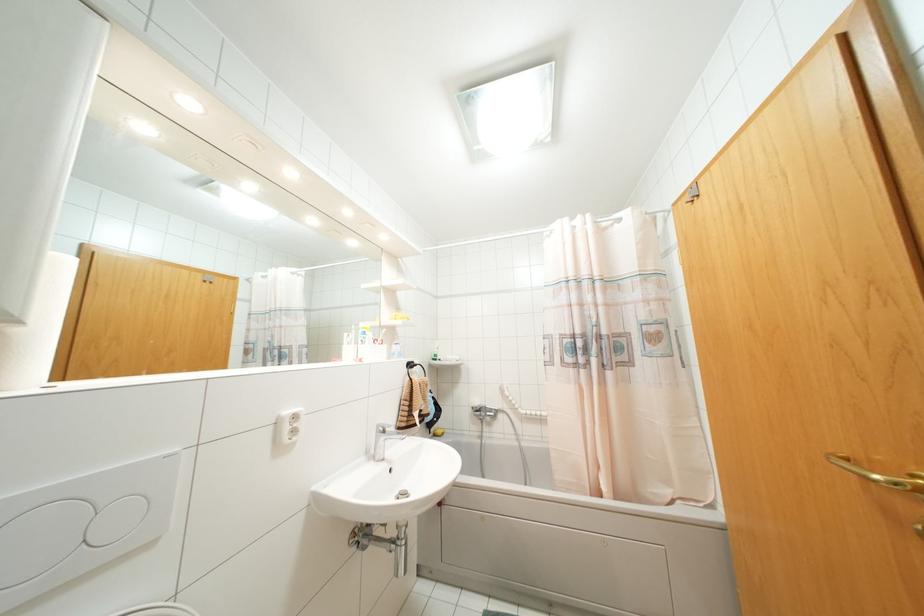
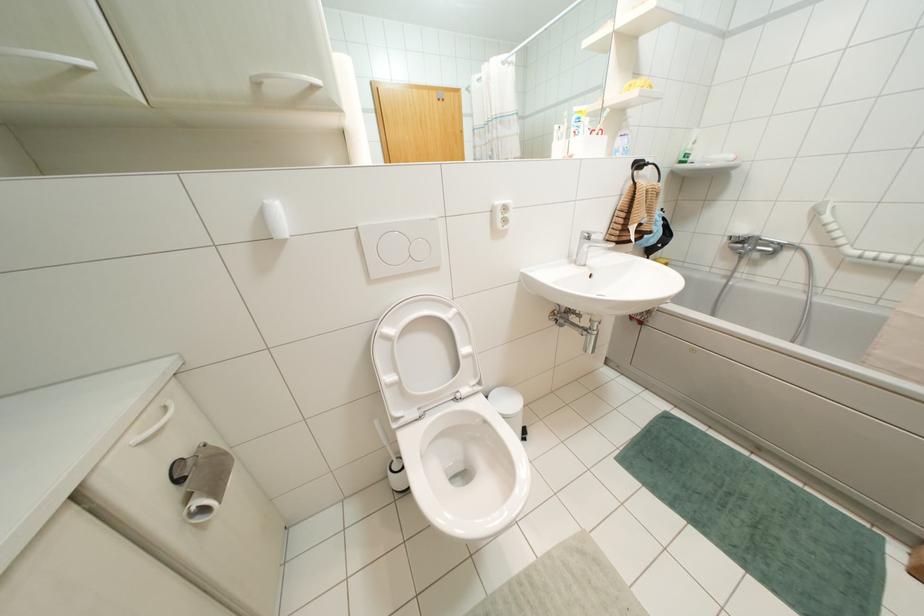
The images are taken continuously from a first-person perspective. In which direction is your viewpoint rotating?

The camera's rotation is toward left-down.